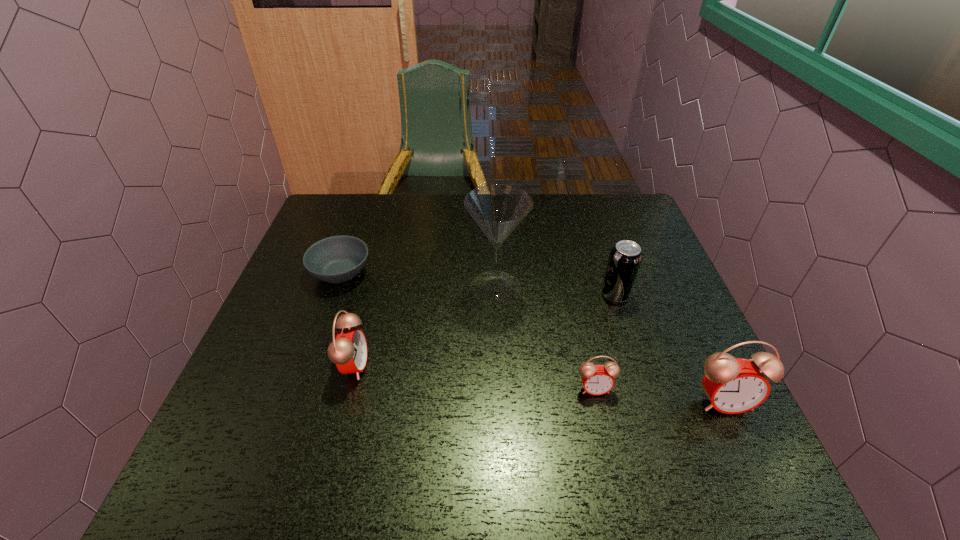
If equal spacing is desired by inserting an extra alarm_clock among them, please point out a free spot for this new alarm_clock. Please provide its 2D coordinates. Your answer should be formatted as a tuple, i.e. [(x, y)], where the tuple contains the x and y coordinates of a point satisfying the conditions above.

[(471, 376)]